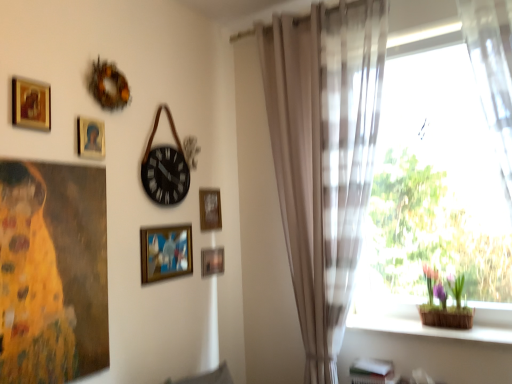
Where is `space that is in front of green leafy plant at right`? This screenshot has width=512, height=384. space that is in front of green leafy plant at right is located at coordinates (462, 334).